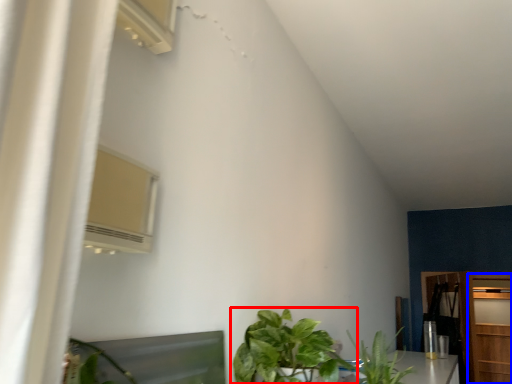
Question: Which point is further to the camera, houseplant (highlighted by a red box) or door (highlighted by a blue box)?

Choices:
 (A) houseplant
 (B) door

Answer: (B)